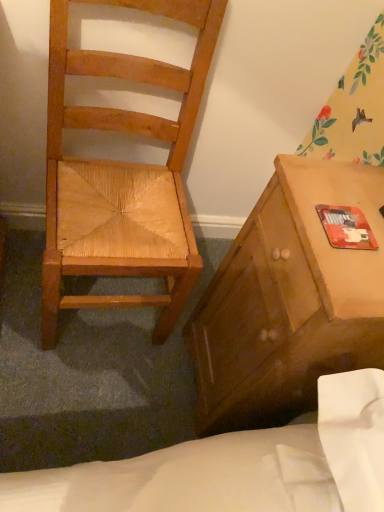
Locate an element on the screen. The width and height of the screenshot is (384, 512). free space in front of red matte mouse pad at right is located at coordinates (345, 279).